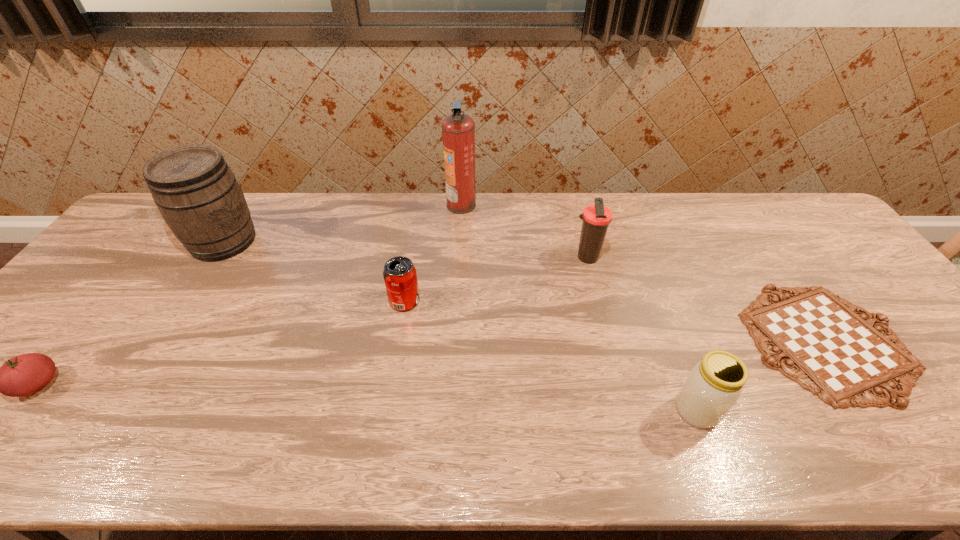
The width and height of the screenshot is (960, 540). In order to click on chessboard in this screenshot , I will do `click(841, 357)`.

I want to click on the rightmost object, so click(x=841, y=357).

What are the coordinates of `free location located 0.260m at the nozzle of the tallest object` in the screenshot? It's located at (552, 205).

Locate an element on the screen. free space located on the back of the second object from left to right is located at coordinates 252,195.

I want to click on free spot located on the front of the thermos bottle, so click(617, 381).

This screenshot has width=960, height=540. In order to click on vacant region located 0.120m on the left of the fourth shortest object in this screenshot , I will do `click(621, 410)`.

Locate an element on the screen. The image size is (960, 540). free spot located on the back of the soda can is located at coordinates (420, 205).

This screenshot has height=540, width=960. I want to click on vacant region located on the front of the chessboard, so click(907, 460).

Locate an element on the screen. This screenshot has height=540, width=960. fire extinguisher present at the far edge is located at coordinates (458, 129).

The image size is (960, 540). What are the coordinates of `wine bucket that is at the far edge` in the screenshot? It's located at (198, 196).